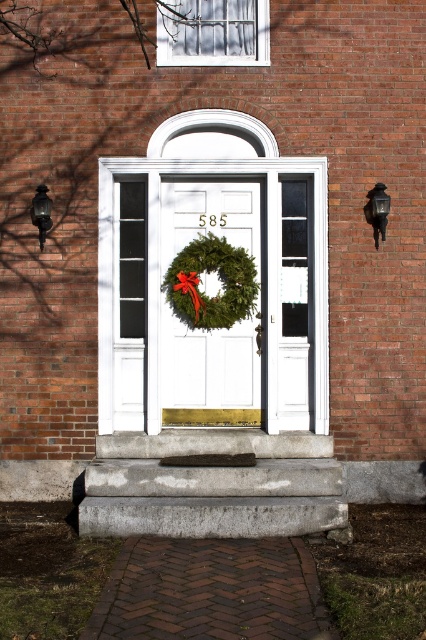
You are a painter who needs to decide whether to bring a ladder or a step stool. The ladder can reach up to 2 meters, while the step stool reaches up to 1 meter. You need to paint the white matte door at center and the matte black lamp at right. Based on their heights, which tool should you use for each object?

The white matte door at center is taller than the matte black lamp at right. Therefore, you should use the ladder for the white matte door at center and the step stool for the matte black lamp at right.

You are standing in front of the brick building and want to place a new wreath exactly where the green matte wreath at center is currently hanging. What are the coordinates where you should place the new wreath?

The green matte wreath at center is located at point (218, 278), so you should place the new wreath at those coordinates.